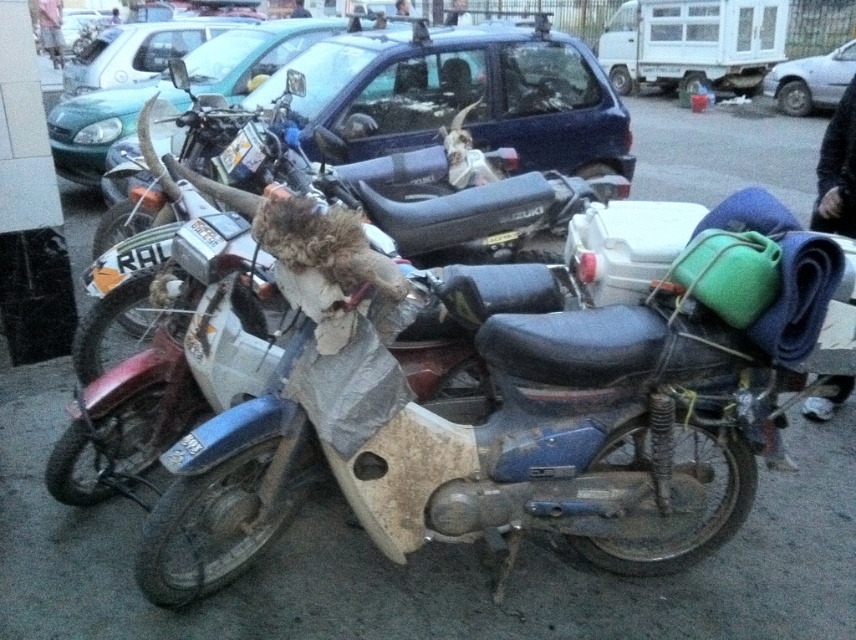
Question: Is green matte car at upper left to the right of metallic silver car at upper center from the viewer's perspective?

Choices:
 (A) no
 (B) yes

Answer: (A)

Question: Does green matte car at upper left lie behind metallic silver car at upper center?

Choices:
 (A) no
 (B) yes

Answer: (A)

Question: Which point is closer to the camera?

Choices:
 (A) metallic silver car at upper center
 (B) green matte car at upper left

Answer: (B)

Question: Among these points, which one is farthest from the camera?

Choices:
 (A) (296, 38)
 (B) (835, 61)

Answer: (B)

Question: Observing the image, what is the correct spatial positioning of green matte car at upper left in reference to metallic silver car at upper center?

Choices:
 (A) left
 (B) right

Answer: (A)

Question: Which point is closer to the camera?

Choices:
 (A) green matte car at upper left
 (B) metallic silver car at upper center

Answer: (A)